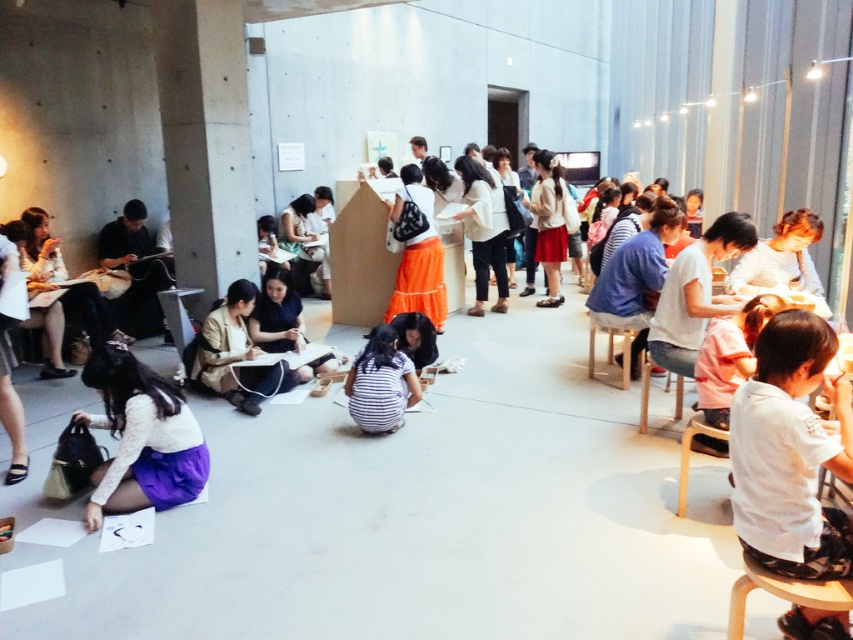
How far apart are purple lace skirt at lower left and matte beige jacket at center?

purple lace skirt at lower left and matte beige jacket at center are 1.28 meters apart from each other.

Is point (107, 474) more distant than point (252, 369)?

No, it is in front of (252, 369).

I want to click on purple lace skirt at lower left, so click(x=141, y=436).

Does wooden chair at center lie in front of light wood chair at lower right?

No, wooden chair at center is further to the viewer.

Does wooden chair at center appear under light wood chair at lower right?

Actually, wooden chair at center is above light wood chair at lower right.

Does point (589, 376) come in front of point (695, 412)?

That is False.

You are a GUI agent. You are given a task and a screenshot of the screen. Output one action in this format:
    pyautogui.click(x=<x>, y=<y>)
    Task: Click on the wooden chair at center
    The width and height of the screenshot is (853, 640).
    Given the screenshot: What is the action you would take?
    pyautogui.click(x=612, y=337)

Is matte beige jacket at center further to the viewer compared to striped fabric at center?

Yes, matte beige jacket at center is behind striped fabric at center.

Which is more to the right, matte beige jacket at center or striped fabric at center?

striped fabric at center

Identify the location of matte beige jacket at center. (233, 355).